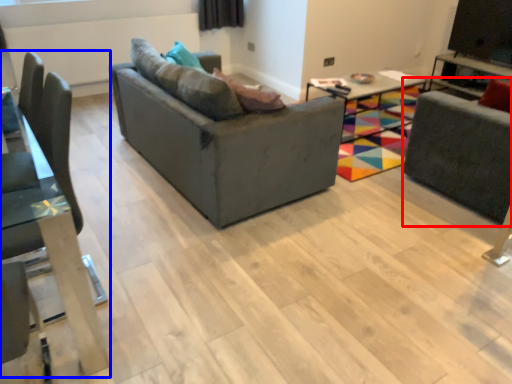
Question: Among these objects, which one is farthest to the camera, swivel chair (highlighted by a red box) or chair (highlighted by a blue box)?

Choices:
 (A) swivel chair
 (B) chair

Answer: (A)